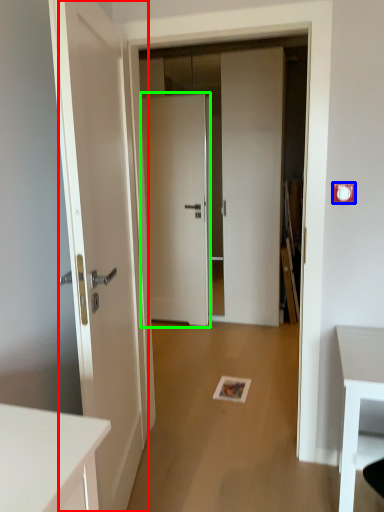
Question: Which object is the closest to the door (highlighted by a red box)? Choose among these: electric outlet (highlighted by a blue box) or door (highlighted by a green box).

Choices:
 (A) electric outlet
 (B) door

Answer: (A)